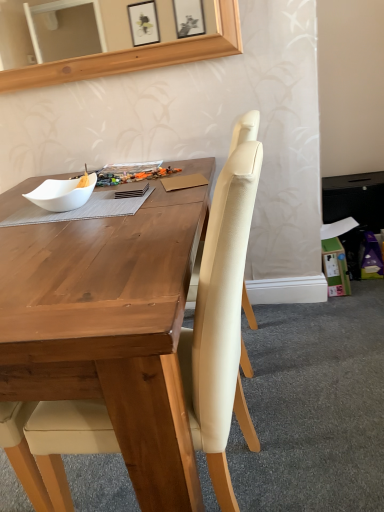
Question: Can you confirm if green cardboard box at lower right is wider than beige fabric chair at center?

Choices:
 (A) yes
 (B) no

Answer: (B)

Question: Is green cardboard box at lower right thinner than beige fabric chair at center?

Choices:
 (A) yes
 (B) no

Answer: (A)

Question: From the image's perspective, is green cardboard box at lower right on beige fabric chair at center?

Choices:
 (A) yes
 (B) no

Answer: (A)

Question: Considering the relative sizes of green cardboard box at lower right and beige fabric chair at center in the image provided, is green cardboard box at lower right taller than beige fabric chair at center?

Choices:
 (A) no
 (B) yes

Answer: (A)

Question: Is beige fabric chair at center at the back of green cardboard box at lower right?

Choices:
 (A) yes
 (B) no

Answer: (B)

Question: Considering the positions of white matte bowl at left and green cardboard box at lower right in the image, is white matte bowl at left bigger or smaller than green cardboard box at lower right?

Choices:
 (A) big
 (B) small

Answer: (B)

Question: From a real-world perspective, is white matte bowl at left physically located above or below green cardboard box at lower right?

Choices:
 (A) above
 (B) below

Answer: (A)

Question: Would you say white matte bowl at left is inside or outside green cardboard box at lower right?

Choices:
 (A) outside
 (B) inside

Answer: (A)

Question: Considering the relative positions of white matte bowl at left and green cardboard box at lower right in the image provided, is white matte bowl at left to the left or to the right of green cardboard box at lower right?

Choices:
 (A) left
 (B) right

Answer: (A)

Question: Looking at the image, does beige fabric chair at center seem bigger or smaller compared to white matte bowl at left?

Choices:
 (A) small
 (B) big

Answer: (B)

Question: Considering their positions, is beige fabric chair at center located in front of or behind white matte bowl at left?

Choices:
 (A) front
 (B) behind

Answer: (A)

Question: From a real-world perspective, relative to white matte bowl at left, is beige fabric chair at center vertically above or below?

Choices:
 (A) above
 (B) below

Answer: (B)

Question: Considering the positions of beige fabric chair at center and white matte bowl at left in the image, is beige fabric chair at center wider or thinner than white matte bowl at left?

Choices:
 (A) wide
 (B) thin

Answer: (A)

Question: Considering the relative positions of green cardboard box at lower right and white matte bowl at left in the image provided, is green cardboard box at lower right to the left or to the right of white matte bowl at left?

Choices:
 (A) left
 (B) right

Answer: (B)

Question: In the image, is green cardboard box at lower right positioned in front of or behind white matte bowl at left?

Choices:
 (A) behind
 (B) front

Answer: (A)